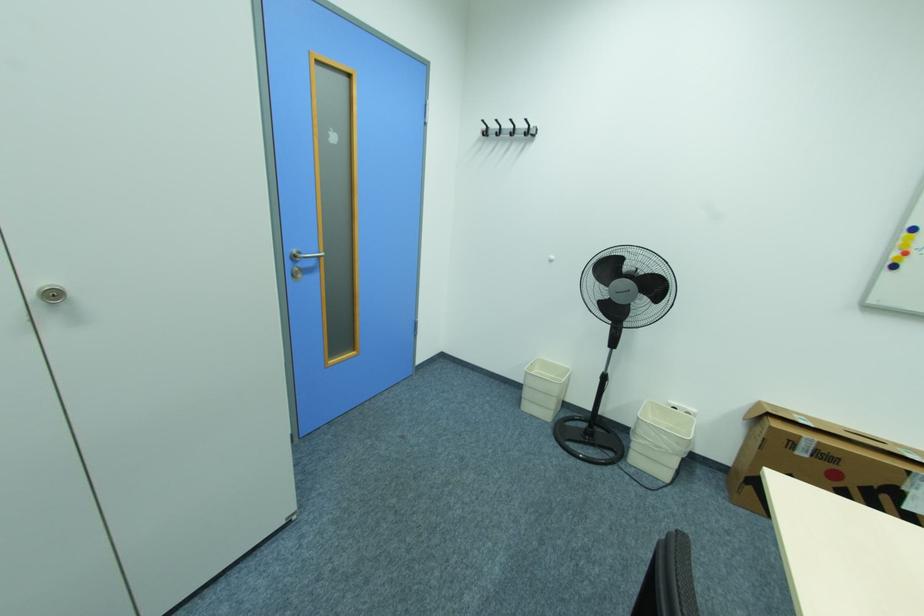
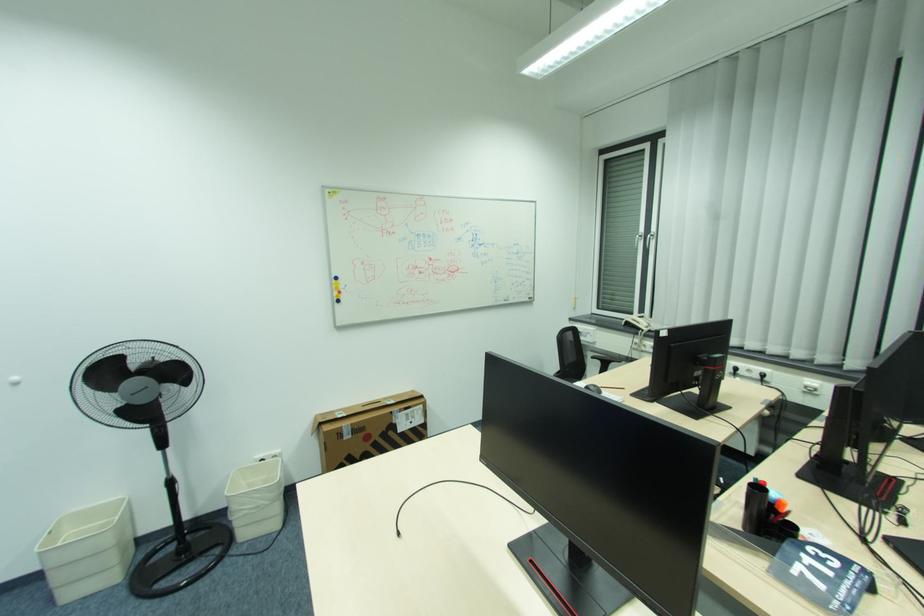
Locate, in the second image, the point that corresponds to (x=805, y=437) in the first image.

(346, 427)